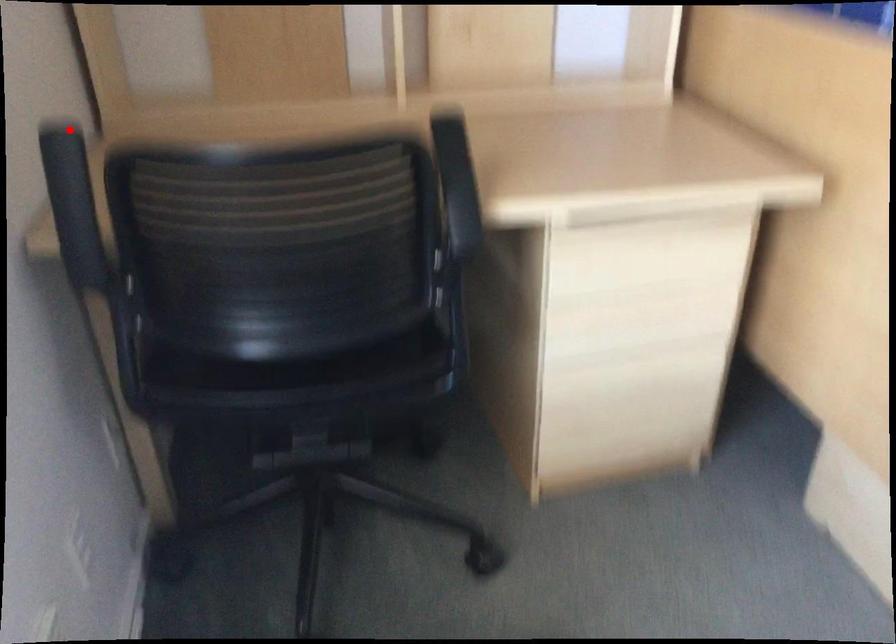
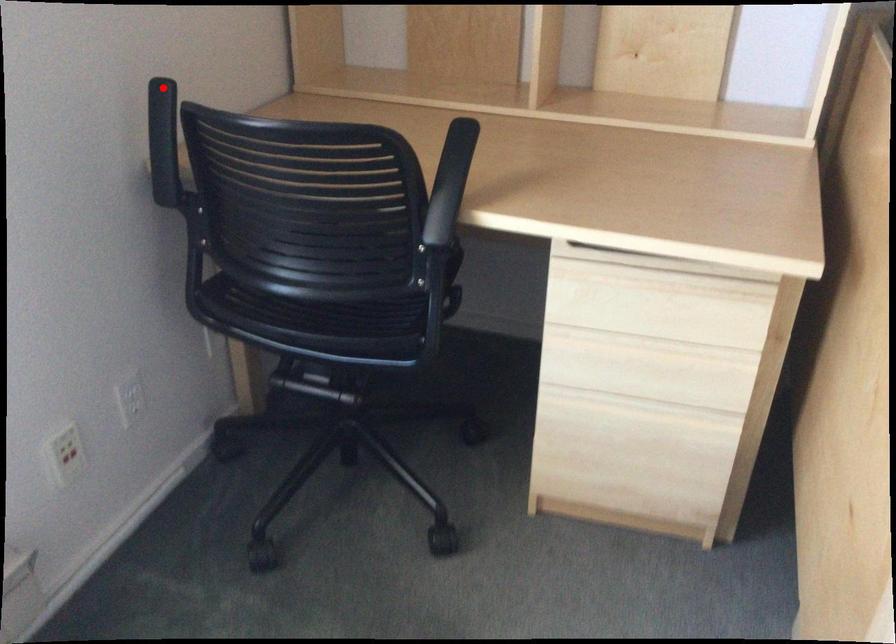
I am providing you with two images of the same scene from different viewpoints. A red point is marked on the first image and another point is marked on the second image. Does the point marked in image1 correspond to the same location as the one in image2?

Yes